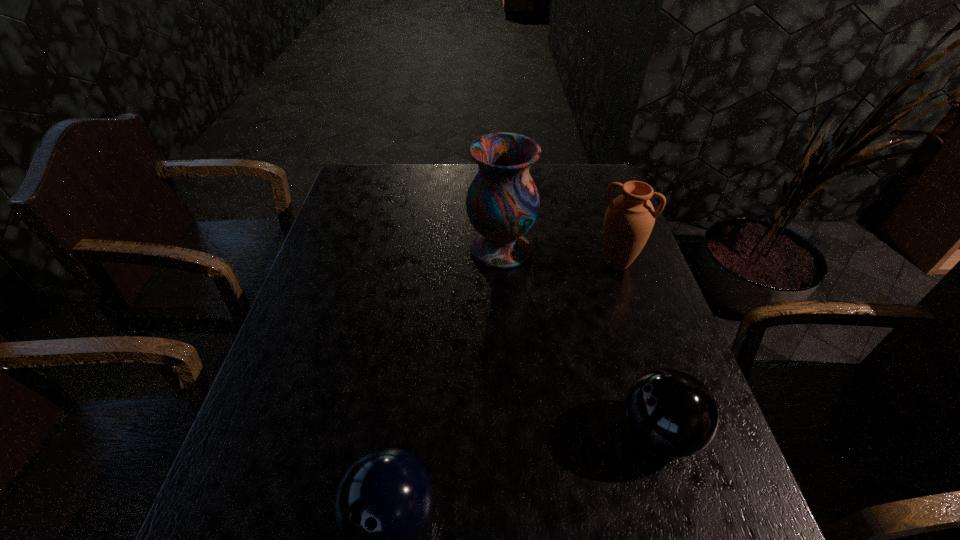
Point out which object is positioned as the third nearest to the vase. Please provide its 2D coordinates. Your answer should be formatted as a tuple, i.e. [(x, y)], where the tuple contains the x and y coordinates of a point satisfying the conditions above.

[(384, 501)]